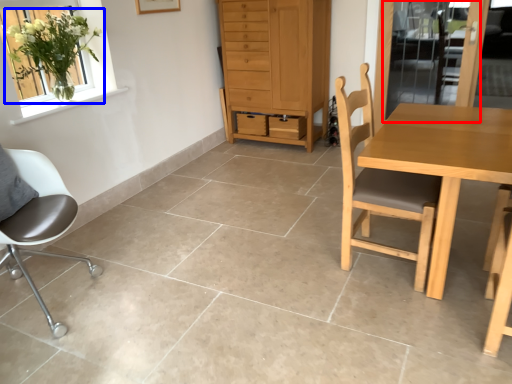
Question: Which object appears farthest to the camera in this image, screen door (highlighted by a red box) or houseplant (highlighted by a blue box)?

Choices:
 (A) screen door
 (B) houseplant

Answer: (A)